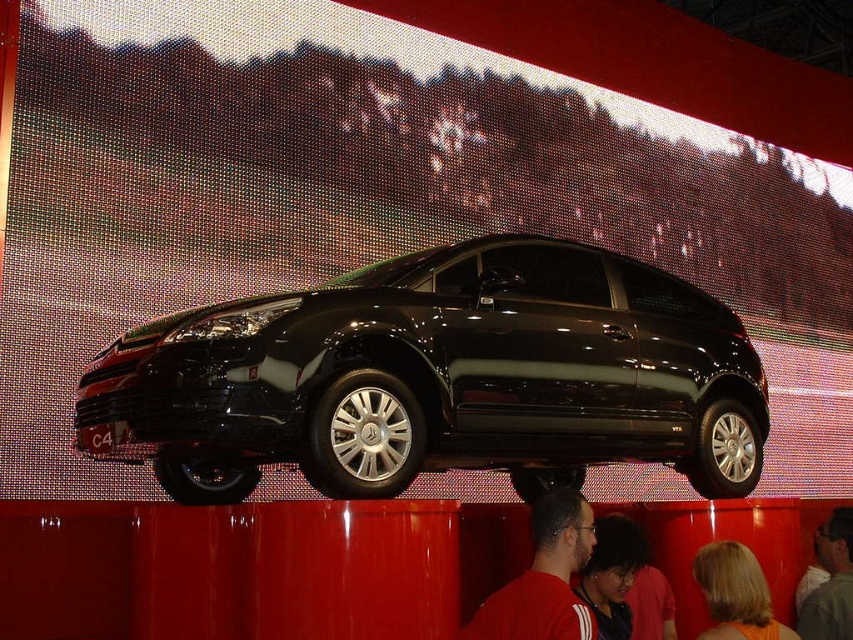
Between red shirt at center and blonde hair at lower right, which one is positioned lower?

blonde hair at lower right is below.

Between point (531, 593) and point (733, 618), which one is positioned behind?

The point (733, 618) is behind.

Where is `red shirt at center`? red shirt at center is located at coordinates (543, 579).

Is glossy black car at center smaller than blonde hair at lower right?

Incorrect, glossy black car at center is not smaller in size than blonde hair at lower right.

Is glossy black car at center below blonde hair at lower right?

No.

Where is `glossy black car at center`? The height and width of the screenshot is (640, 853). glossy black car at center is located at coordinates (438, 378).

Identify the location of glossy black car at center. This screenshot has width=853, height=640. (438, 378).

Does point (463, 632) lie in front of point (836, 508)?

That is True.

Consider the image. How distant is red shirt at center from smooth white shirt at center?

They are 1.64 meters apart.

Does point (532, 525) come farther from viewer compared to point (846, 554)?

No, it is not.

I want to click on red shirt at center, so click(543, 579).